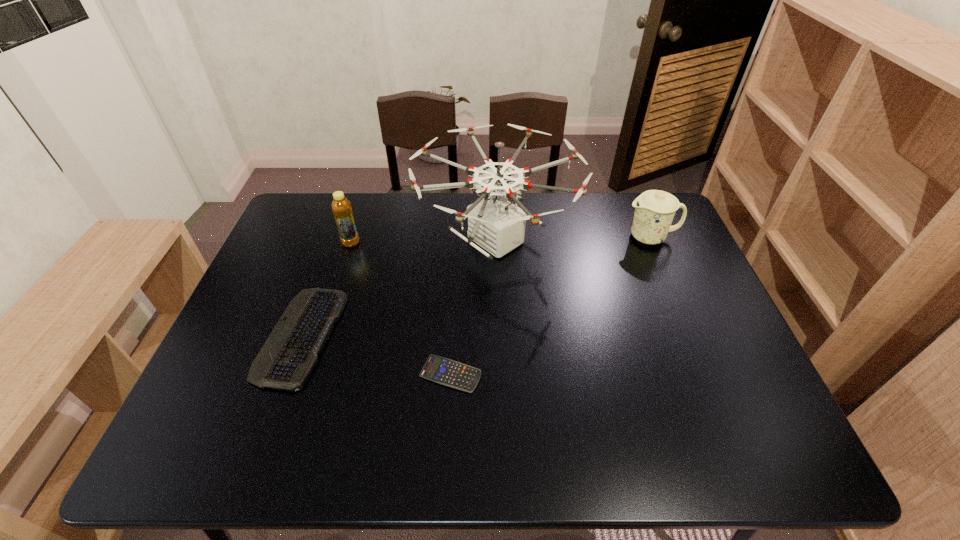
You are a GUI agent. You are given a task and a screenshot of the screen. Output one action in this format:
    pyautogui.click(x=<x>, y=<y>)
    Task: Click on the free space located on the right of the fourth tallest object
    
    Given the screenshot: What is the action you would take?
    pyautogui.click(x=470, y=336)

The height and width of the screenshot is (540, 960). Find the location of `free spot located on the back of the calculator`. free spot located on the back of the calculator is located at coordinates (453, 333).

The image size is (960, 540). In order to click on drone present at the far edge in this screenshot , I will do `click(497, 225)`.

Find the location of `chinaware that is at the far edge`. chinaware that is at the far edge is located at coordinates (654, 210).

At what (x,y) coordinates should I click in order to perform the action: click on object located at the left edge. Please return your answer as a coordinate pair (x, y). The image size is (960, 540). Looking at the image, I should click on (287, 358).

This screenshot has height=540, width=960. Find the location of `object that is at the right edge`. object that is at the right edge is located at coordinates (654, 210).

I want to click on object that is at the far right corner, so click(x=654, y=210).

Identify the location of vacant area at the far edge of the desktop. coord(541,194).

In the image, there is a desktop. Where is `vacant area at the near edge`? Image resolution: width=960 pixels, height=540 pixels. vacant area at the near edge is located at coordinates (496, 434).

At what (x,y) coordinates should I click in order to perform the action: click on free spot at the left edge of the desktop. Please return your answer as a coordinate pair (x, y). Looking at the image, I should click on (298, 284).